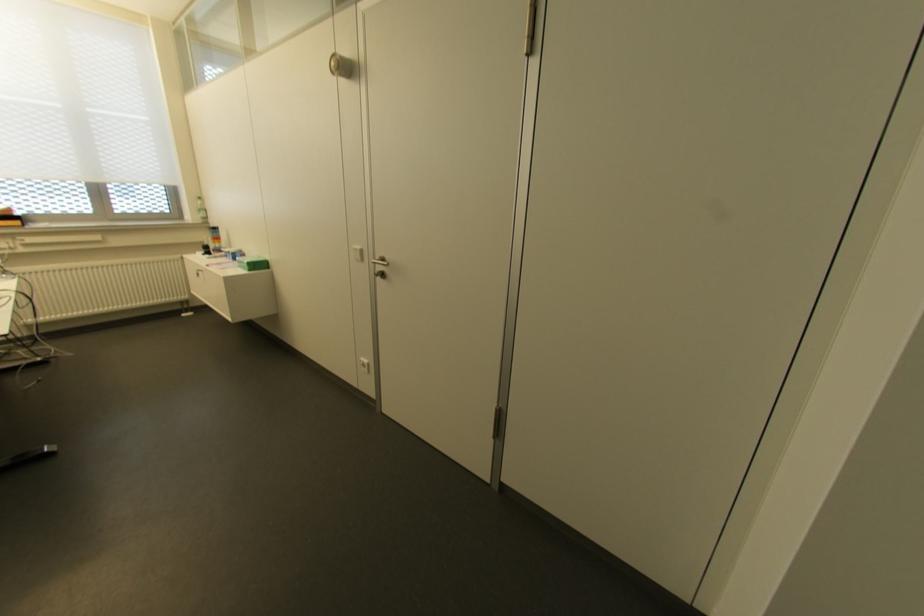
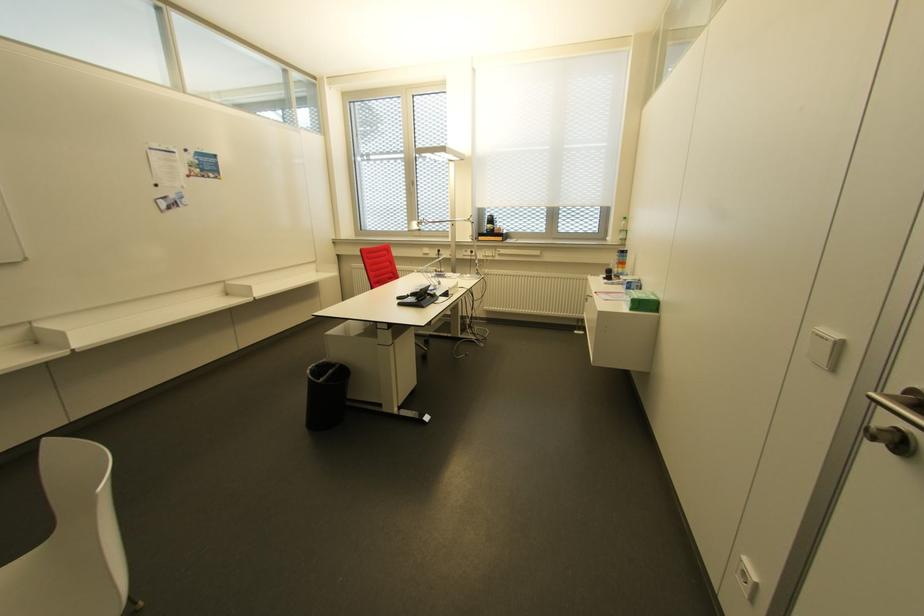
Find the pixel in the second image that matches pixel 204 217 in the first image.

(623, 240)